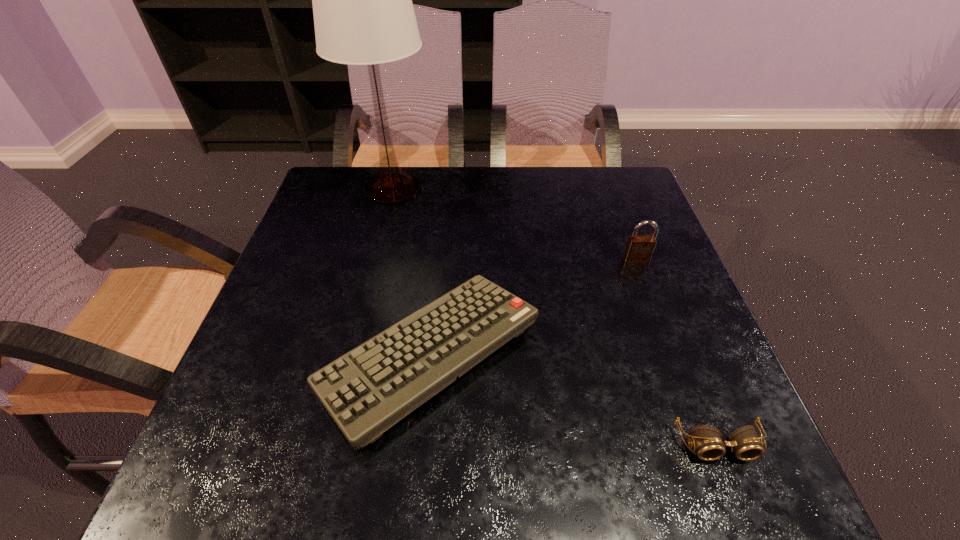
At what (x,y) coordinates should I click in order to perform the action: click on vacant space at the near edge of the desktop. Please return your answer as a coordinate pair (x, y). The width and height of the screenshot is (960, 540). Looking at the image, I should click on (375, 457).

This screenshot has width=960, height=540. Identify the location of vacant space at the left edge. (338, 244).

What are the coordinates of `vacant region at the right edge of the desktop` in the screenshot? It's located at (676, 426).

The image size is (960, 540). I want to click on vacant region at the far left corner of the desktop, so click(360, 211).

Find the location of a particular element. The height and width of the screenshot is (540, 960). free space at the far right corner of the desktop is located at coordinates (592, 206).

This screenshot has height=540, width=960. I want to click on free space between the goggles and the tallest object, so click(555, 316).

Where is `vacant area between the computer keyboard and the tallest object`? Image resolution: width=960 pixels, height=540 pixels. vacant area between the computer keyboard and the tallest object is located at coordinates (411, 271).

The height and width of the screenshot is (540, 960). What are the coordinates of `free spot between the tallest object and the goggles` in the screenshot? It's located at (555, 316).

The height and width of the screenshot is (540, 960). In order to click on vacant region between the goggles and the third shortest object in this screenshot , I will do `click(677, 353)`.

This screenshot has height=540, width=960. I want to click on free spot between the goggles and the third nearest object, so click(x=677, y=353).